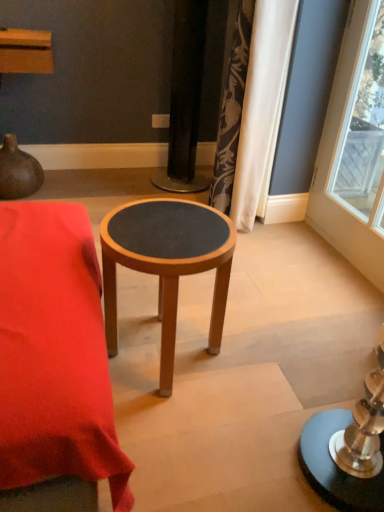
You are a GUI agent. You are given a task and a screenshot of the screen. Output one action in this format:
    pyautogui.click(x=<x>, y=<y>)
    Task: Click on the wooden stool at center
    This screenshot has height=512, width=384.
    Given the screenshot: What is the action you would take?
    pyautogui.click(x=54, y=353)

Describe the element at coordinates (167, 264) in the screenshot. I see `wooden stool at center` at that location.

At what (x,y) coordinates should I click in order to perform the action: click on brown matte vase at upper left. Please return your answer as a coordinate pair (x, y). This screenshot has height=512, width=384. Looking at the image, I should click on (18, 170).

What's the angular difference between silky floral curtain at upper right and wooden stool at center's facing directions?

The angular difference between silky floral curtain at upper right and wooden stool at center is 89.4 degrees.

Which point is more forward, (262, 33) or (0, 261)?

Point (0, 261)

Which is correct: silky floral curtain at upper right is inside wooden stool at center, or outside of it?

silky floral curtain at upper right is not enclosed by wooden stool at center.

Where is `curtain above the wooden stool at center (from the image's perspective)`? curtain above the wooden stool at center (from the image's perspective) is located at coordinates (262, 108).

Identify the location of curtain above the wooden stool at center (from a real-world perspective). (262, 108).

Can you confirm if wooden stool at center is positioned to the right of silky floral curtain at upper right?

In fact, wooden stool at center is to the left of silky floral curtain at upper right.

From a real-world perspective, does wooden stool at center sit lower than silky floral curtain at upper right?

Correct, in the physical world, wooden stool at center is lower than silky floral curtain at upper right.

Is wooden stool at center smaller than wooden stool at center?

Indeed, wooden stool at center has a smaller size compared to wooden stool at center.

Between wooden stool at center and wooden stool at center, which one has smaller width?

wooden stool at center.

From a real-world perspective, is wooden stool at center located higher than wooden stool at center?

No, from a real-world perspective, wooden stool at center is not above wooden stool at center.

Does wooden stool at center have a greater height compared to wooden stool at center?

Correct, wooden stool at center is much taller as wooden stool at center.

From the image's perspective, is brown matte vase at upper left located beneath silky floral curtain at upper right?

Correct, brown matte vase at upper left appears lower than silky floral curtain at upper right in the image.

Would you say brown matte vase at upper left is inside or outside silky floral curtain at upper right?

brown matte vase at upper left is not enclosed by silky floral curtain at upper right.

Is brown matte vase at upper left oriented away from silky floral curtain at upper right?

No, brown matte vase at upper left's orientation is not away from silky floral curtain at upper right.

From the image's perspective, which is above, silky floral curtain at upper right or brown matte vase at upper left?

silky floral curtain at upper right is shown above in the image.

Locate an element on the screen. The image size is (384, 512). curtain above the brown matte vase at upper left (from the image's perspective) is located at coordinates (262, 108).

Considering the relative sizes of silky floral curtain at upper right and brown matte vase at upper left in the image provided, is silky floral curtain at upper right wider than brown matte vase at upper left?

Correct, the width of silky floral curtain at upper right exceeds that of brown matte vase at upper left.

How different are the orientations of silky floral curtain at upper right and brown matte vase at upper left in degrees?

87.2 degrees separate the facing orientations of silky floral curtain at upper right and brown matte vase at upper left.

Based on the photo, is brown matte vase at upper left behind wooden stool at center?

Yes.

Based on the photo, from the image's perspective, is brown matte vase at upper left positioned above or below wooden stool at center?

brown matte vase at upper left is above wooden stool at center.

Is brown matte vase at upper left at the right side of wooden stool at center?

In fact, brown matte vase at upper left is to the left of wooden stool at center.

Looking at their sizes, would you say brown matte vase at upper left is wider or thinner than wooden stool at center?

Clearly, brown matte vase at upper left has less width compared to wooden stool at center.

Does wooden stool at center have a greater height compared to brown matte vase at upper left?

No.

Does wooden stool at center contain brown matte vase at upper left?

No, brown matte vase at upper left is located outside of wooden stool at center.

Is wooden stool at center next to brown matte vase at upper left and touching it?

No, wooden stool at center is not in contact with brown matte vase at upper left.

Between wooden stool at center and brown matte vase at upper left, which one is positioned in front?

wooden stool at center is closer to the camera.

Identify the location of table below the silky floral curtain at upper right (from the image's perspective). This screenshot has height=512, width=384. (54, 353).

You are a GUI agent. You are given a task and a screenshot of the screen. Output one action in this format:
    pyautogui.click(x=<x>, y=<y>)
    Task: Click on the curtain that appears above the wooden stool at center (from the image's perspective)
    The width and height of the screenshot is (384, 512).
    Given the screenshot: What is the action you would take?
    pyautogui.click(x=262, y=108)

From the image, which object appears to be farther from brown matte vase at upper left, wooden stool at center or silky floral curtain at upper right?

The object further to brown matte vase at upper left is wooden stool at center.

Estimate the real-world distances between objects in this image. Which object is closer to wooden stool at center, silky floral curtain at upper right or brown matte vase at upper left?

The object closer to wooden stool at center is silky floral curtain at upper right.

When comparing their distances from silky floral curtain at upper right, does brown matte vase at upper left or wooden stool at center seem closer?

wooden stool at center is closer to silky floral curtain at upper right.

Based on their spatial positions, is wooden stool at center or wooden stool at center further from brown matte vase at upper left?

The object further to brown matte vase at upper left is wooden stool at center.

When comparing their distances from wooden stool at center, does wooden stool at center or brown matte vase at upper left seem further?

Among the two, brown matte vase at upper left is located further to wooden stool at center.

Looking at the image, which one is located further to wooden stool at center, wooden stool at center or silky floral curtain at upper right?

Among the two, silky floral curtain at upper right is located further to wooden stool at center.

From the image, which object appears to be farther from wooden stool at center, wooden stool at center or brown matte vase at upper left?

brown matte vase at upper left lies further to wooden stool at center than the other object.

Estimate the real-world distances between objects in this image. Which object is further from silky floral curtain at upper right, wooden stool at center or wooden stool at center?

wooden stool at center lies further to silky floral curtain at upper right than the other object.

This screenshot has height=512, width=384. Identify the location of stool between brown matte vase at upper left and silky floral curtain at upper right in the horizontal direction. (167, 264).

Identify the location of curtain between wooden stool at center and brown matte vase at upper left in the front-back direction. (262, 108).

I want to click on stool between wooden stool at center and brown matte vase at upper left in the front-back direction, so (167, 264).

Where is `stool located between wooden stool at center and silky floral curtain at upper right in the depth direction`? stool located between wooden stool at center and silky floral curtain at upper right in the depth direction is located at coordinates (167, 264).